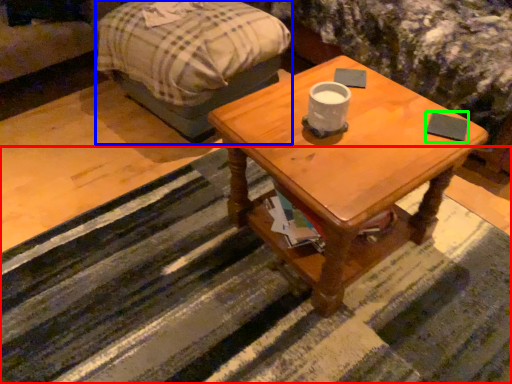
Question: Which object is the farthest from strip (highlighted by a red box)? Choose among these: bed frame (highlighted by a blue box) or pad (highlighted by a green box).

Choices:
 (A) bed frame
 (B) pad

Answer: (B)